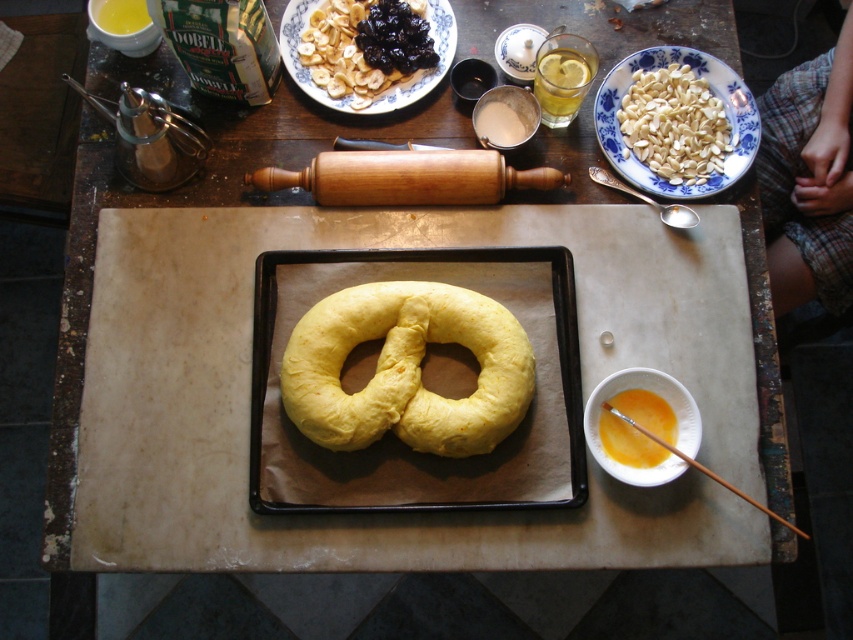
In the scene shown: You are a baker preparing to decorate a dessert. You have a yellow doughnut at center and white smooth almonds at upper right. Which object would you choose if you need to use the larger item for decoration?

The yellow doughnut at center is bigger than the white smooth almonds at upper right, so you should choose the yellow doughnut at center for decoration.

You are a chef preparing a dessert and need to place both the yellow doughnut at center and the white smooth almonds at upper right on a shelf. The shelf has limited vertical space. Which item will require more vertical space?

The yellow doughnut at center requires more vertical space because it is much taller than the white smooth almonds at upper right.

You are standing in the kitchen and want to reach both the point at coordinates (311, 76) and the point at coordinates (650, 461). Which point will you reach first?

You will reach the point at coordinates (311, 76) first because it is closer to you than the point at coordinates (650, 461), which is further away.